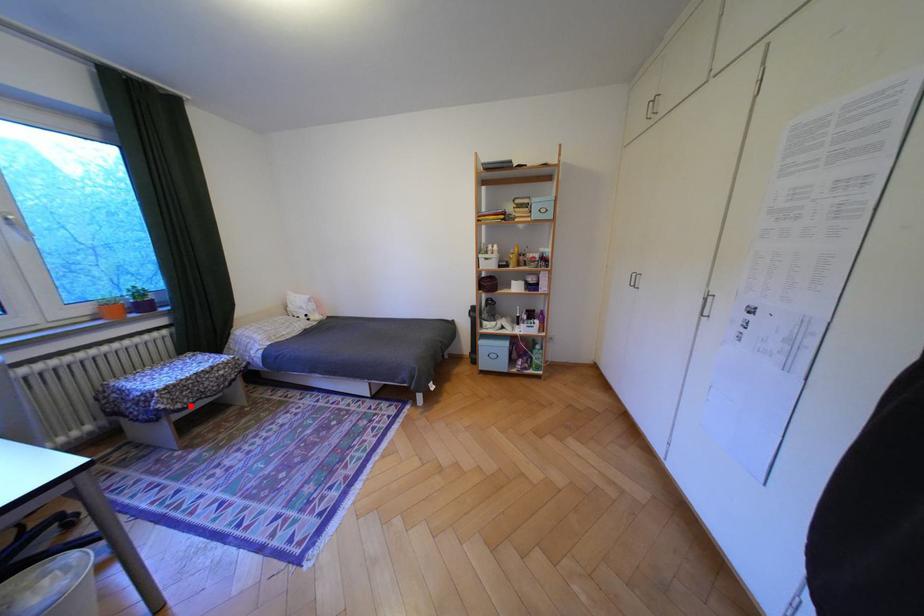
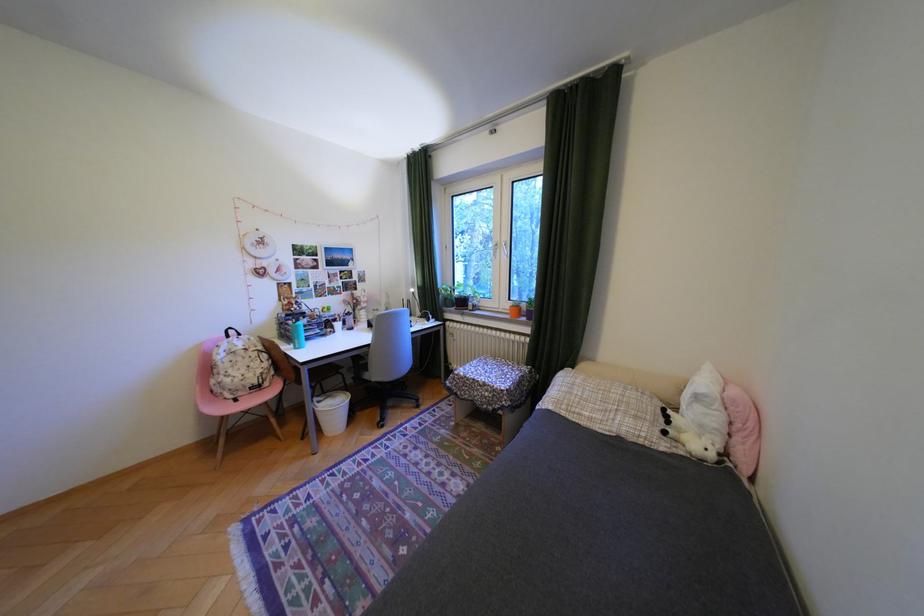
The point at the highlighted location is marked in the first image. Where is the corresponding point in the second image?

(470, 392)